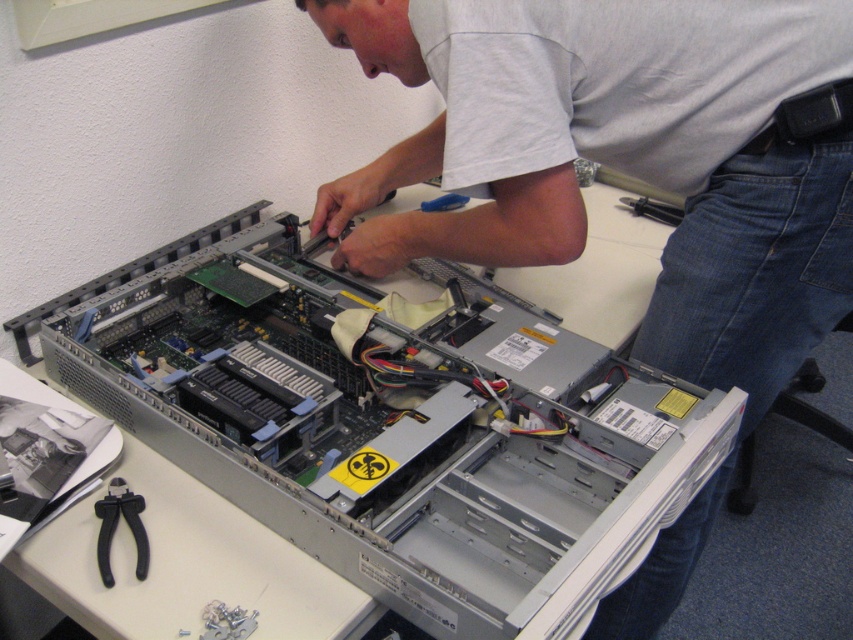
Is gray matte computer case at center to the right of black plastic pliers at lower left from the viewer's perspective?

Indeed, gray matte computer case at center is positioned on the right side of black plastic pliers at lower left.

Is point (485, 161) farther from viewer compared to point (136, 499)?

No, (485, 161) is closer to viewer.

The height and width of the screenshot is (640, 853). I want to click on gray matte computer case at center, so click(x=627, y=156).

Does silver metallic server at center lie in front of black plastic pliers at lower left?

Yes.

Is point (334, 452) closer to viewer compared to point (114, 477)?

Yes, it is in front of point (114, 477).

At what (x,y) coordinates should I click in order to perform the action: click on silver metallic server at center. Please return your answer as a coordinate pair (x, y). Looking at the image, I should click on (392, 424).

Between silver metallic server at center and gray matte computer case at center, which one is positioned higher?

gray matte computer case at center

Who is shorter, silver metallic server at center or gray matte computer case at center?

silver metallic server at center

You are a GUI agent. You are given a task and a screenshot of the screen. Output one action in this format:
    pyautogui.click(x=<x>, y=<y>)
    Task: Click on the silver metallic server at center
    Image resolution: width=853 pixels, height=640 pixels.
    Given the screenshot: What is the action you would take?
    pyautogui.click(x=392, y=424)